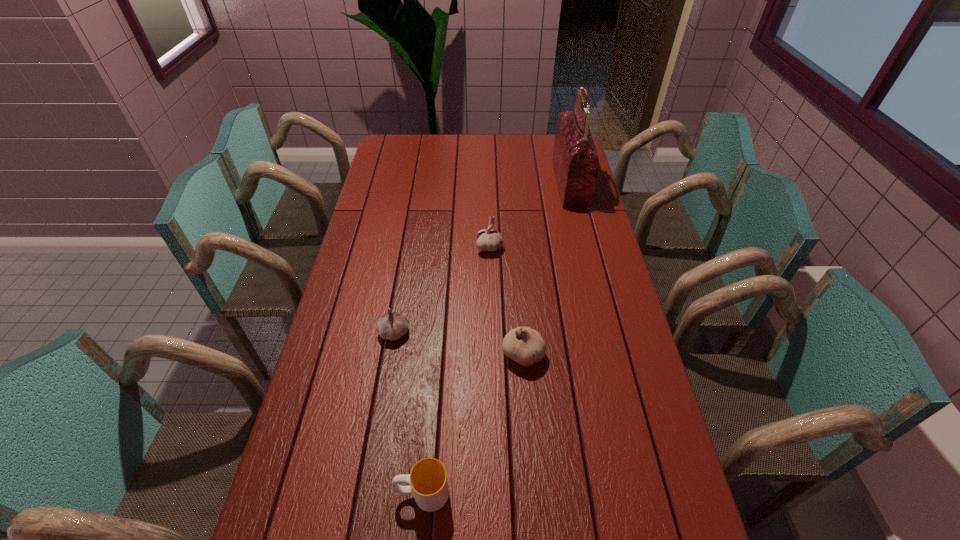
Where is `garlic that is the closest to the farthest garlic`? garlic that is the closest to the farthest garlic is located at coordinates (524, 345).

Where is `garlic that is the closest to the leftmost garlic`? garlic that is the closest to the leftmost garlic is located at coordinates coord(524,345).

This screenshot has width=960, height=540. Identify the location of vacant region that satisfies the following two spatial constraints: 1. with the handle on the side of the cup; 2. on the front side of the leftmost garlic. (436, 333).

At what (x,y) coordinates should I click in order to perform the action: click on free location that satisfies the following two spatial constraints: 1. with the handle on the side of the second object from left to right; 2. on the right side of the farthest garlic. Please return your answer as a coordinate pair (x, y). The image size is (960, 540). Looking at the image, I should click on (444, 247).